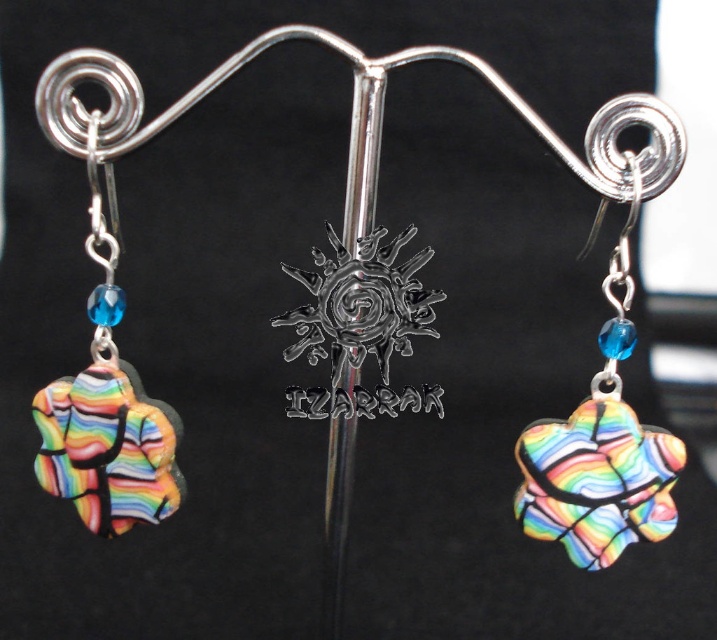
Between rainbow glass heart at center and rainbow glass flower at left, which one has less height?

rainbow glass heart at center is shorter.

Is rainbow glass heart at center positioned before rainbow glass flower at left?

Yes, it is in front of rainbow glass flower at left.

Is point (566, 506) positioned behind point (148, 474)?

No.

Find the location of a particular element. rainbow glass heart at center is located at coordinates (607, 385).